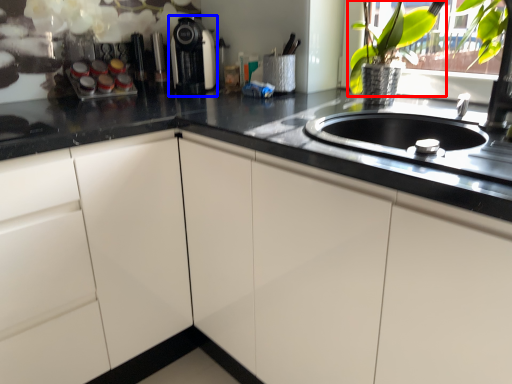
Question: Which object appears farthest to the camera in this image, floral arrangement (highlighted by a red box) or coffee machine (highlighted by a blue box)?

Choices:
 (A) floral arrangement
 (B) coffee machine

Answer: (B)